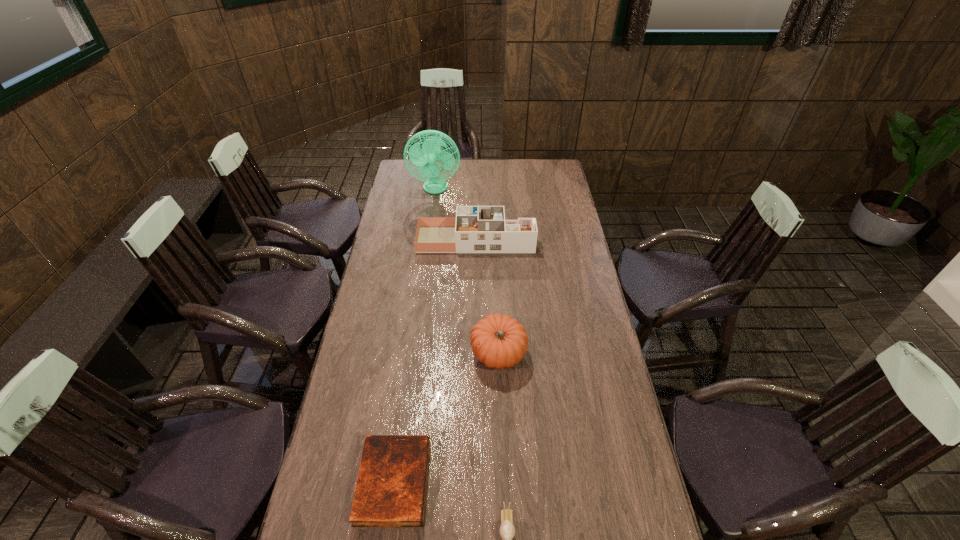
Identify the location of fan that is positioned at the left edge. (426, 158).

Where is `Bible present at the left edge`? Bible present at the left edge is located at coordinates (390, 491).

Where is `object positioned at the far left corner`? Image resolution: width=960 pixels, height=540 pixels. object positioned at the far left corner is located at coordinates (426, 158).

Image resolution: width=960 pixels, height=540 pixels. In the image, there is a desktop. Identify the location of vacant area at the far edge. (439, 174).

Where is `blank space at the left edge`? This screenshot has width=960, height=540. blank space at the left edge is located at coordinates (402, 214).

I want to click on free space at the right edge of the desktop, so click(x=600, y=376).

This screenshot has height=540, width=960. Find the location of `free point between the second farthest object and the third farthest object`. free point between the second farthest object and the third farthest object is located at coordinates (487, 296).

Locate an element on the screen. unoccupied area between the fan and the Bible is located at coordinates (415, 335).

Where is `vacant area that lies between the pumpkin and the Bible`? The width and height of the screenshot is (960, 540). vacant area that lies between the pumpkin and the Bible is located at coordinates (446, 417).

At what (x,y) coordinates should I click in order to perform the action: click on free spot between the dollhouse and the fan. Please return your answer as a coordinate pair (x, y). Looking at the image, I should click on (456, 214).